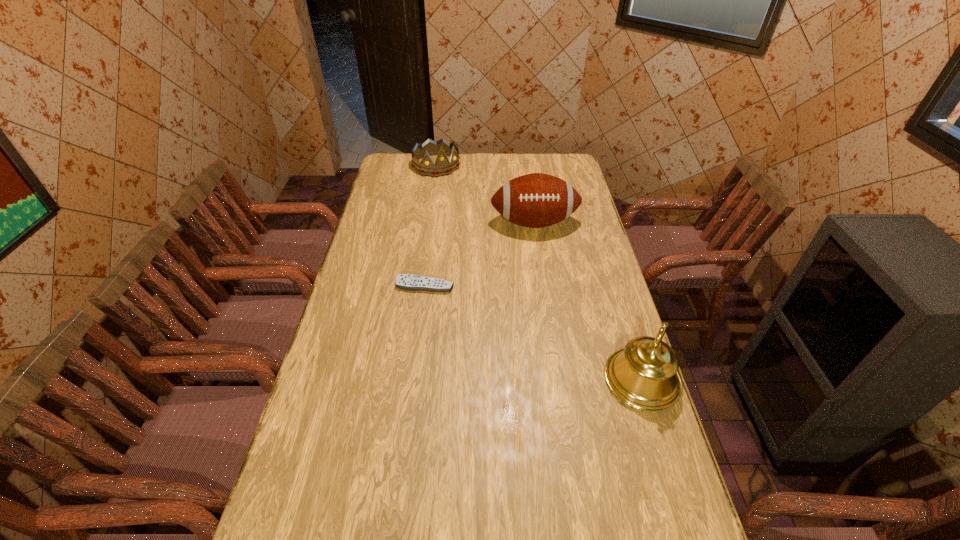
This screenshot has width=960, height=540. What are the coordinates of `remote control` in the screenshot? It's located at (410, 282).

The width and height of the screenshot is (960, 540). I want to click on the shortest object, so click(x=410, y=282).

In order to click on the nearest object in this screenshot , I will do `click(644, 375)`.

Where is `the third tallest object`? the third tallest object is located at coordinates (441, 148).

Locate an element on the screen. This screenshot has height=540, width=960. the farthest object is located at coordinates (441, 148).

You are a GUI agent. You are given a task and a screenshot of the screen. Output one action in this format:
    pyautogui.click(x=<x>, y=<y>)
    Task: Click on the third nearest object
    
    Given the screenshot: What is the action you would take?
    pyautogui.click(x=535, y=200)

This screenshot has height=540, width=960. I want to click on vacant point located on the front of the second nearest object, so click(x=411, y=393).

Image resolution: width=960 pixels, height=540 pixels. What are the coordinates of `free spot located on the back of the nearest object` in the screenshot? It's located at (616, 299).

Find the location of a particular element. vacant space located 0.380m at the front of the second shortest object with jewels is located at coordinates (470, 222).

Find the location of a particular element. free space located at the front of the second shortest object with jewels is located at coordinates (448, 186).